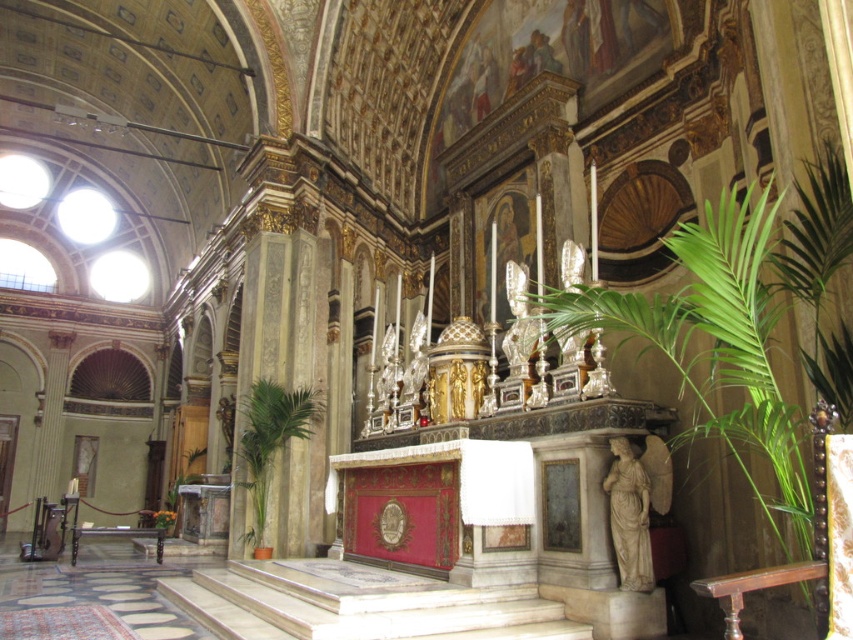
Question: Is green leafy plant at right below green leafy plant at lower left?

Choices:
 (A) yes
 (B) no

Answer: (B)

Question: Which point appears closest to the camera in this image?

Choices:
 (A) (722, 230)
 (B) (254, 468)

Answer: (A)

Question: Is green leafy plant at right thinner than green leafy plant at lower left?

Choices:
 (A) no
 (B) yes

Answer: (A)

Question: Which of the following is the closest to the observer?

Choices:
 (A) (746, 444)
 (B) (265, 426)

Answer: (A)

Question: Among these points, which one is nearest to the camera?

Choices:
 (A) click(253, 497)
 (B) click(821, 596)

Answer: (B)

Question: Is green leafy plant at right to the right of green leafy plant at lower left from the viewer's perspective?

Choices:
 (A) no
 (B) yes

Answer: (B)